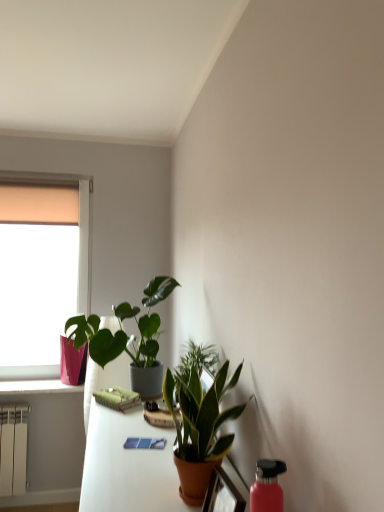
What are the coordinates of `blank space above pink plastic window sill at left (from a real-world perspective)` in the screenshot? It's located at (34, 382).